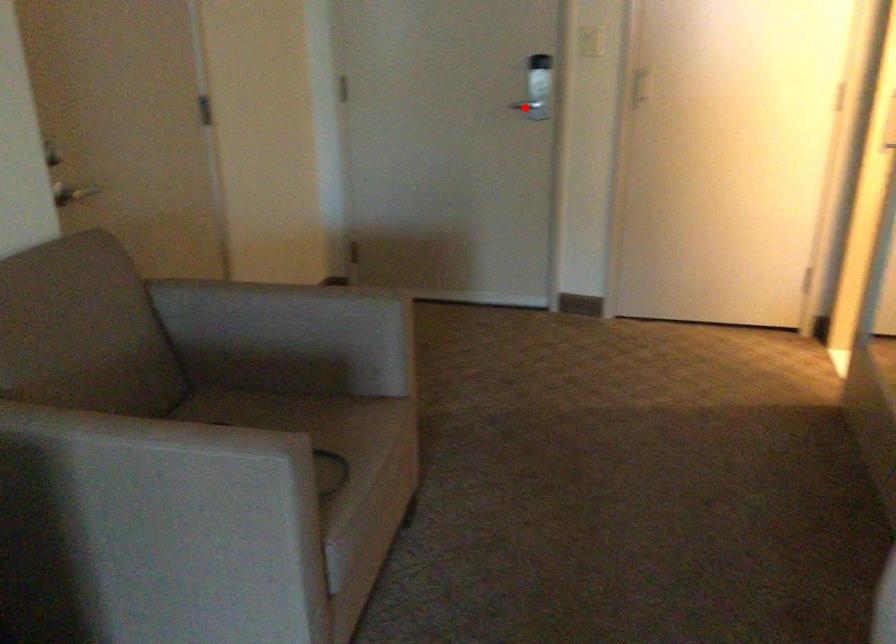
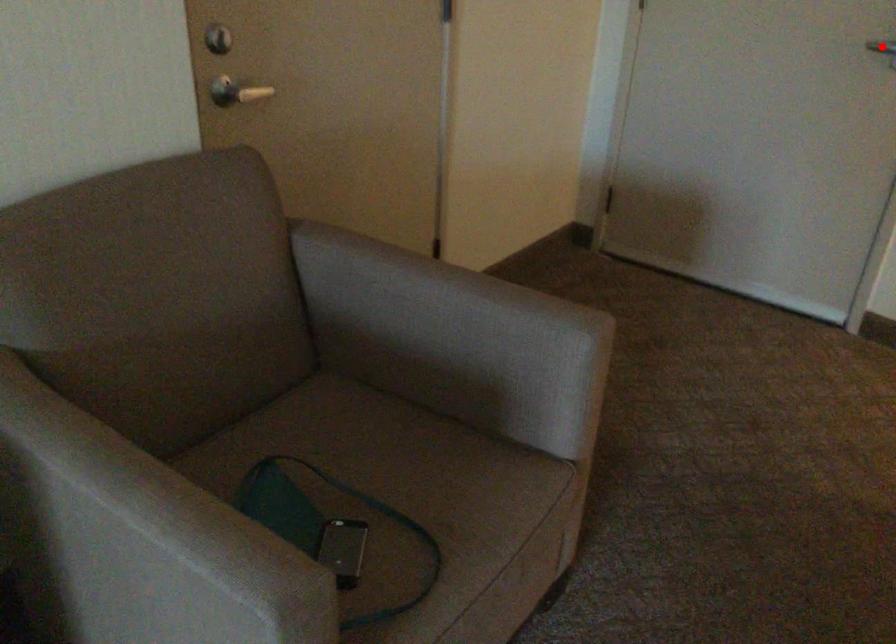
Looking at this image, I am providing you with two images of the same scene from different viewpoints. A red point is marked on the first image and another point is marked on the second image. Is the marked point in image1 the same physical position as the marked point in image2?

Yes